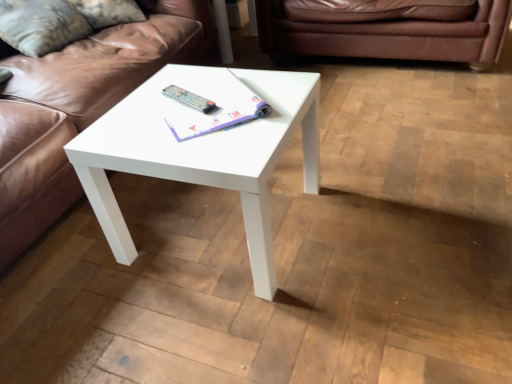
Question: Is silver metallic remote at center at the right side of brown leather couch at upper left, which ranks as the 2th studio couch in right-to-left order?

Choices:
 (A) yes
 (B) no

Answer: (A)

Question: Does silver metallic remote at center have a greater height compared to brown leather couch at upper left, arranged as the 1th studio couch when viewed from the left?

Choices:
 (A) yes
 (B) no

Answer: (B)

Question: Considering the relative positions of silver metallic remote at center and brown leather couch at upper left, which ranks as the 2th studio couch in right-to-left order, in the image provided, is silver metallic remote at center to the left of brown leather couch at upper left, which ranks as the 2th studio couch in right-to-left order, from the viewer's perspective?

Choices:
 (A) yes
 (B) no

Answer: (B)

Question: Is silver metallic remote at center closer to the viewer compared to brown leather couch at upper left, arranged as the 1th studio couch when viewed from the left?

Choices:
 (A) no
 (B) yes

Answer: (A)

Question: From a real-world perspective, is silver metallic remote at center under brown leather couch at upper left, which ranks as the 2th studio couch in right-to-left order?

Choices:
 (A) yes
 (B) no

Answer: (B)

Question: From a real-world perspective, is brown leather couch at center, which ranks as the 2th studio couch in left-to-right order, above or below velvet floral pillow at upper left?

Choices:
 (A) below
 (B) above

Answer: (A)

Question: Considering their positions, is brown leather couch at center, which appears as the 1th studio couch when viewed from the right, located in front of or behind velvet floral pillow at upper left?

Choices:
 (A) behind
 (B) front

Answer: (A)

Question: Based on their sizes in the image, would you say brown leather couch at center, which appears as the 1th studio couch when viewed from the right, is bigger or smaller than velvet floral pillow at upper left?

Choices:
 (A) big
 (B) small

Answer: (A)

Question: Is brown leather couch at center, which appears as the 1th studio couch when viewed from the right, spatially inside velvet floral pillow at upper left, or outside of it?

Choices:
 (A) inside
 (B) outside

Answer: (B)

Question: Is white glossy coffee table at center wider or thinner than velvet floral pillow at upper left?

Choices:
 (A) wide
 (B) thin

Answer: (A)

Question: Is point (278, 144) closer or farther from the camera than point (57, 11)?

Choices:
 (A) farther
 (B) closer

Answer: (B)

Question: From the image's perspective, is white glossy coffee table at center located above or below velvet floral pillow at upper left?

Choices:
 (A) above
 (B) below

Answer: (B)

Question: Based on their sizes in the image, would you say white glossy coffee table at center is bigger or smaller than velvet floral pillow at upper left?

Choices:
 (A) small
 (B) big

Answer: (B)

Question: In terms of width, does brown leather couch at center, which ranks as the 2th studio couch in left-to-right order, look wider or thinner when compared to silver metallic remote at center?

Choices:
 (A) thin
 (B) wide

Answer: (B)

Question: Is point (330, 29) positioned closer to the camera than point (202, 105)?

Choices:
 (A) closer
 (B) farther

Answer: (B)